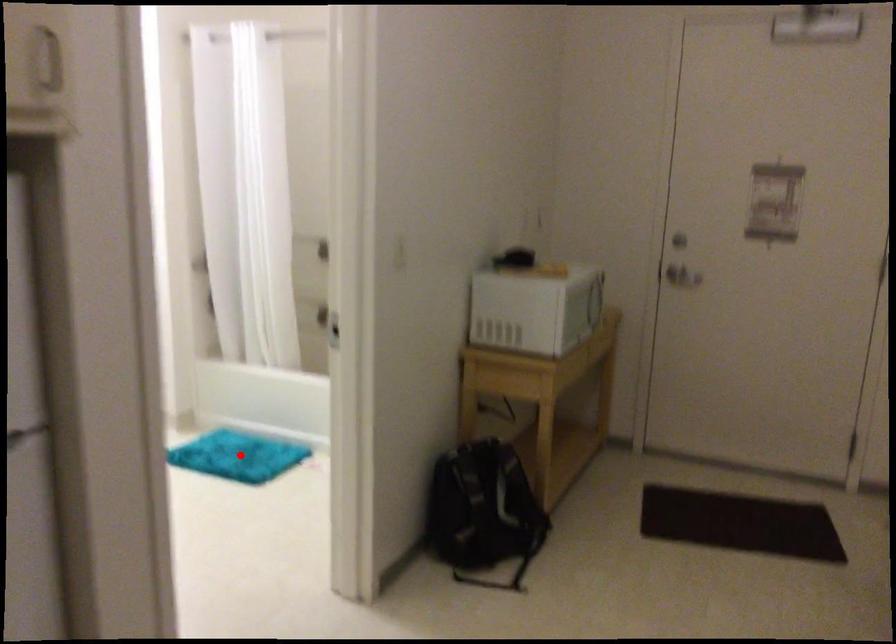
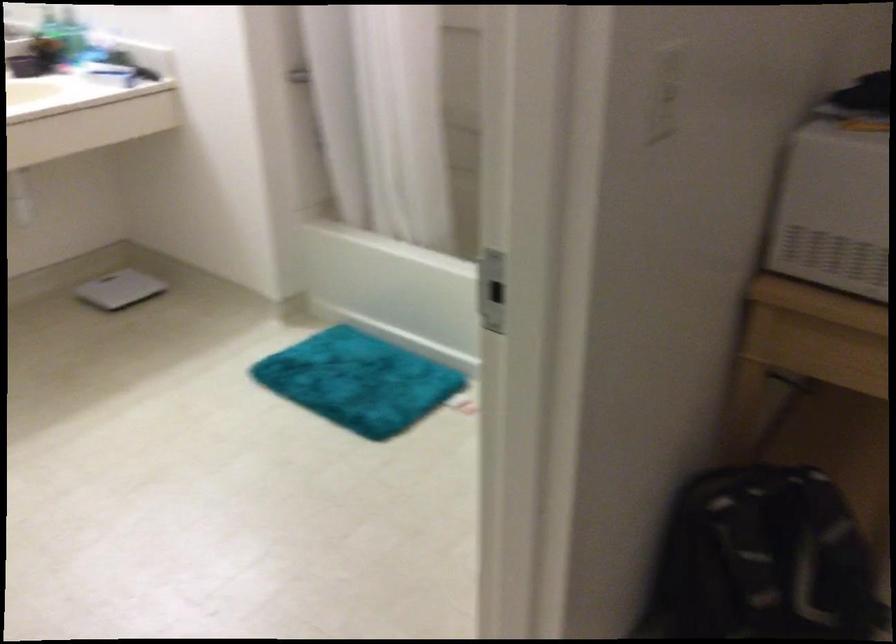
Locate, in the second image, the point that corresponds to the highlighted location in the first image.

(358, 381)